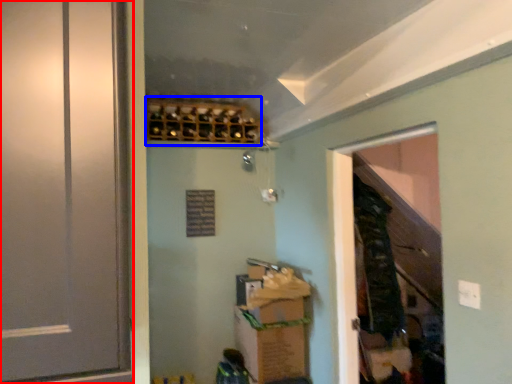
Question: Which point is closer to the camera, door (highlighted by a red box) or wine rack (highlighted by a blue box)?

Choices:
 (A) door
 (B) wine rack

Answer: (A)